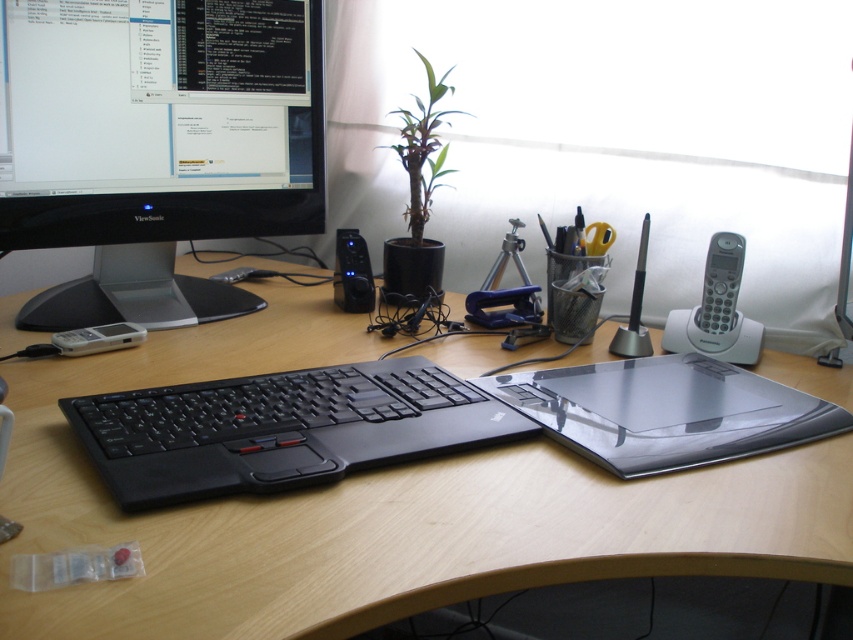
Who is shorter, light brown wood computer desk at center or black plastic monitor at upper left?

Standing shorter between the two is light brown wood computer desk at center.

Who is more forward, (300,576) or (292,164)?

Point (300,576) is in front.

Between point (196, 632) and point (16, 36), which one is positioned behind?

Positioned behind is point (16, 36).

Where is `light brown wood computer desk at center`? The height and width of the screenshot is (640, 853). light brown wood computer desk at center is located at coordinates (379, 508).

Is light brown wood computer desk at center shorter than black matte keyboard at center?

In fact, light brown wood computer desk at center may be taller than black matte keyboard at center.

Is light brown wood computer desk at center positioned behind black matte keyboard at center?

→ No, light brown wood computer desk at center is closer to the viewer.

Between point (181, 596) and point (479, 401), which one is positioned in front?

Positioned in front is point (181, 596).

I want to click on light brown wood computer desk at center, so click(379, 508).

Is light brown wood computer desk at center further to the viewer compared to transparent plastic laptop at center?

No.

Measure the distance between light brown wood computer desk at center and camera.

light brown wood computer desk at center is 44.45 centimeters away from camera.

I want to click on light brown wood computer desk at center, so click(379, 508).